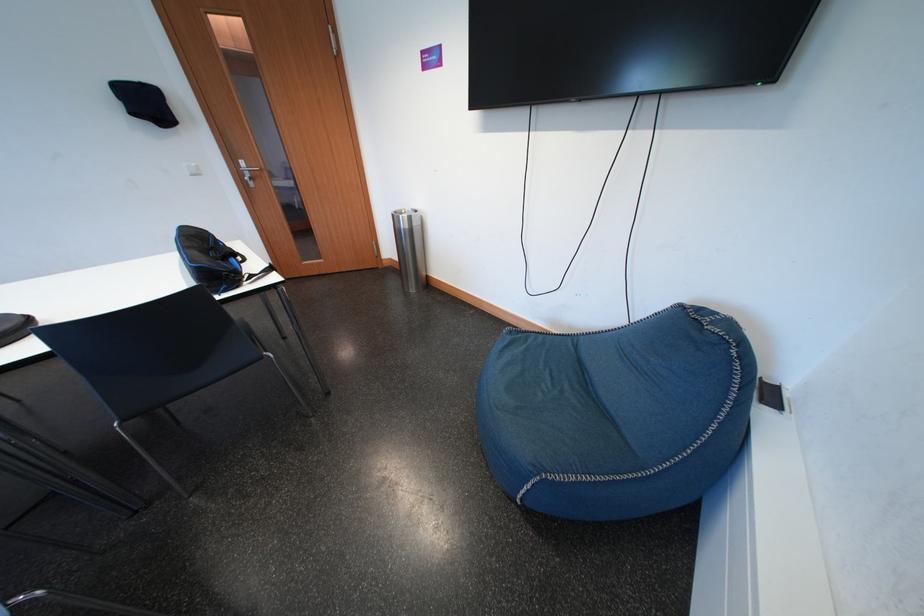
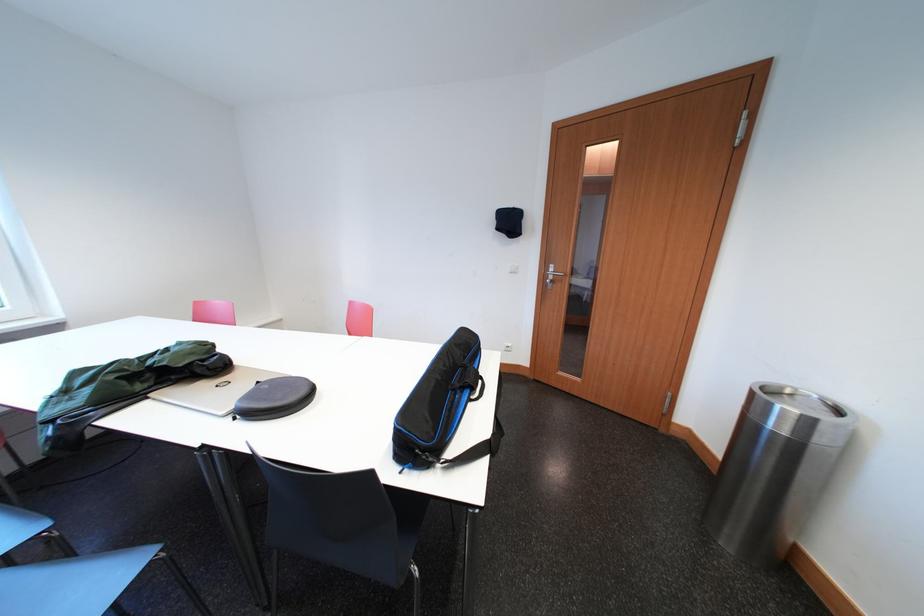
Question: Based on the continuous images, in which direction is the camera rotating? Reply with the corresponding letter.

Choices:
 (A) Left
 (B) Right
 (C) Up
 (D) Down

Answer: (A)